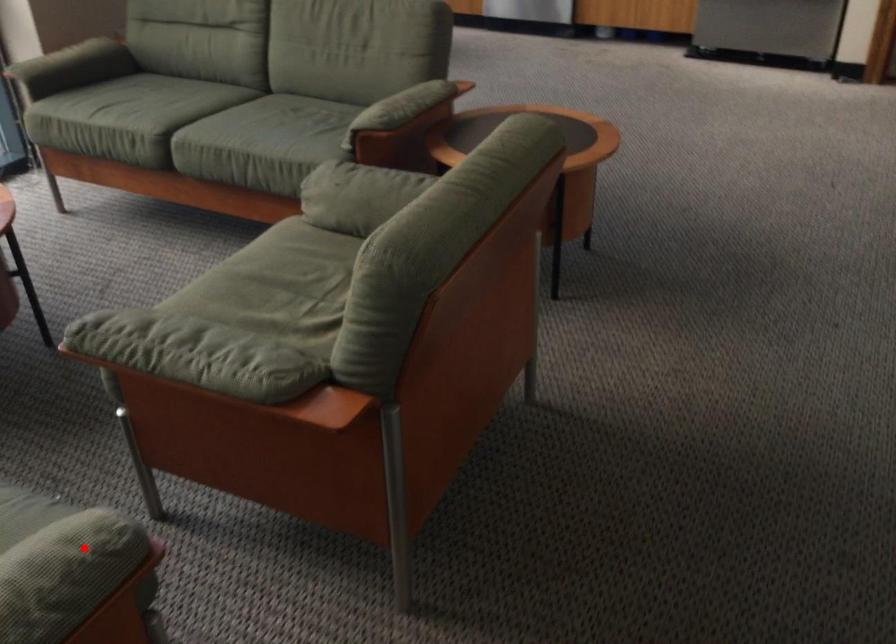
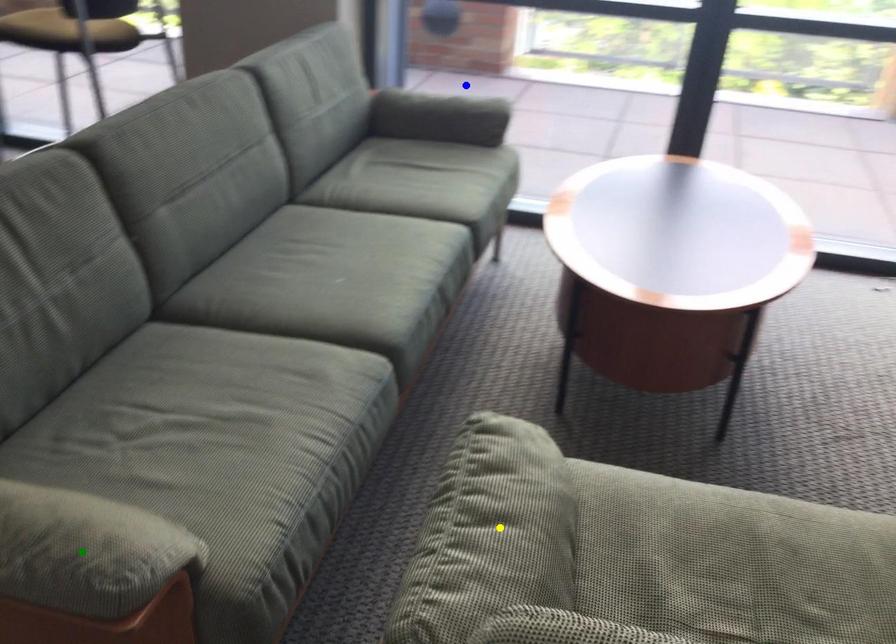
Question: I am providing you with two images of the same scene from different viewpoints. A red point is marked on the first image. You are given multiple points on the second image. Which spot in image 2 lines up with the point in image 1?

Choices:
 (A) green point
 (B) yellow point
 (C) blue point

Answer: (A)